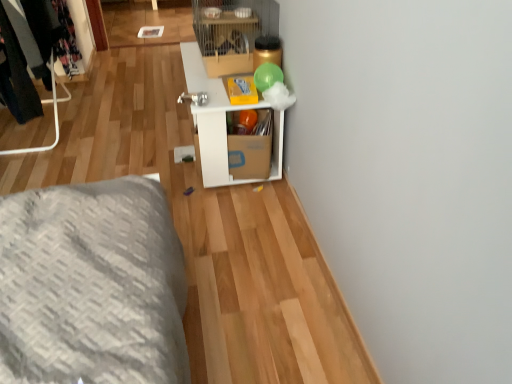
You are a GUI agent. You are given a task and a screenshot of the screen. Output one action in this format:
    pyautogui.click(x=<x>, y=<y>)
    Task: Click on the free point below metal clothing rack at left (from a real-world perspective)
    The width and height of the screenshot is (512, 384).
    Given the screenshot: What is the action you would take?
    pyautogui.click(x=76, y=117)